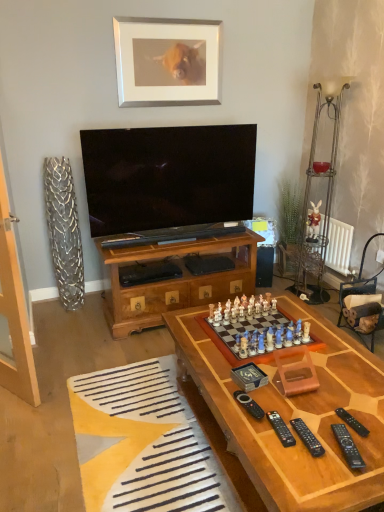
The height and width of the screenshot is (512, 384). Find the location of `free space in front of black plastic remote at lower right, the 4th remote in the right-to-left sequence`. free space in front of black plastic remote at lower right, the 4th remote in the right-to-left sequence is located at coordinates (293, 467).